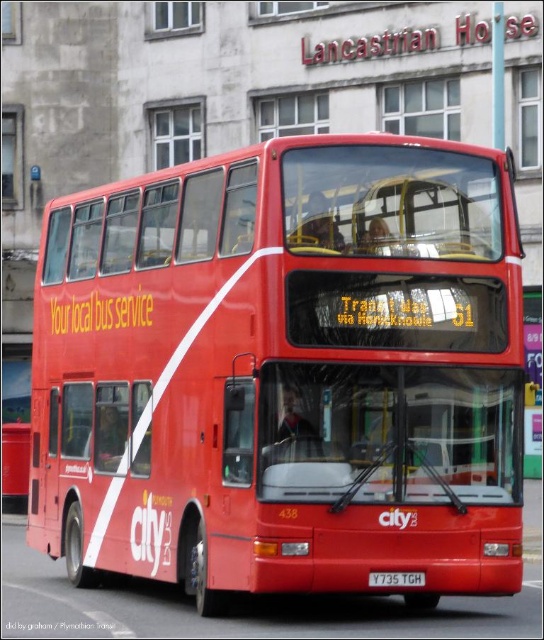
Question: From the image, what is the correct spatial relationship of shiny red bus at center in relation to black metal license plate at center?

Choices:
 (A) left
 (B) right

Answer: (B)

Question: Which object is farther from the camera taking this photo?

Choices:
 (A) black metal license plate at center
 (B) shiny red bus at center

Answer: (B)

Question: Which object appears farthest from the camera in this image?

Choices:
 (A) shiny red bus at center
 (B) black metal license plate at center

Answer: (A)

Question: Is the position of shiny red bus at center less distant than that of black metal license plate at center?

Choices:
 (A) no
 (B) yes

Answer: (A)

Question: Considering the relative positions of shiny red bus at center and black metal license plate at center in the image provided, where is shiny red bus at center located with respect to black metal license plate at center?

Choices:
 (A) below
 (B) above

Answer: (B)

Question: Which of the following is the closest to the observer?

Choices:
 (A) shiny red bus at center
 (B) black metal license plate at center

Answer: (B)